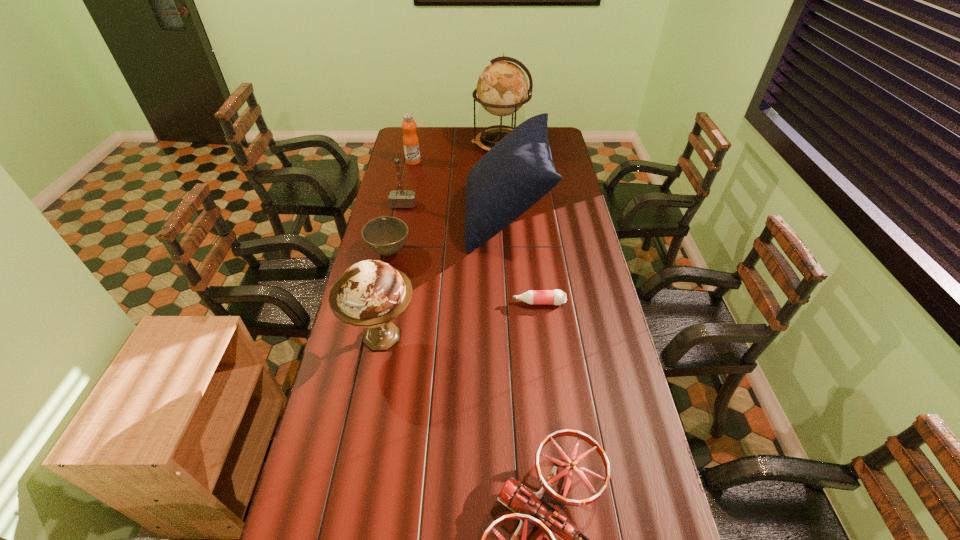
You are a GUI agent. You are given a task and a screenshot of the screen. Output one action in this format:
    pyautogui.click(x=<x>, y=<y>)
    Task: Click on the right globe
    
    Given the screenshot: What is the action you would take?
    pyautogui.click(x=502, y=88)

Where is `the tallest object`? This screenshot has height=540, width=960. the tallest object is located at coordinates (x=502, y=88).

Where is `cushion`? Image resolution: width=960 pixels, height=540 pixels. cushion is located at coordinates (518, 171).

The image size is (960, 540). Identify the location of the second nearest object. (371, 293).

This screenshot has width=960, height=540. Find the location of `the left globe`. the left globe is located at coordinates (371, 293).

Where is `fruit juice`? This screenshot has height=540, width=960. fruit juice is located at coordinates (410, 139).

I want to click on hammer, so click(400, 198).

Identify the location of bowl. Image resolution: width=960 pixels, height=540 pixels. (385, 235).

Find the location of `the shortest object`. the shortest object is located at coordinates (534, 297).

Identify the location of bottle. This screenshot has height=540, width=960. (534, 297).